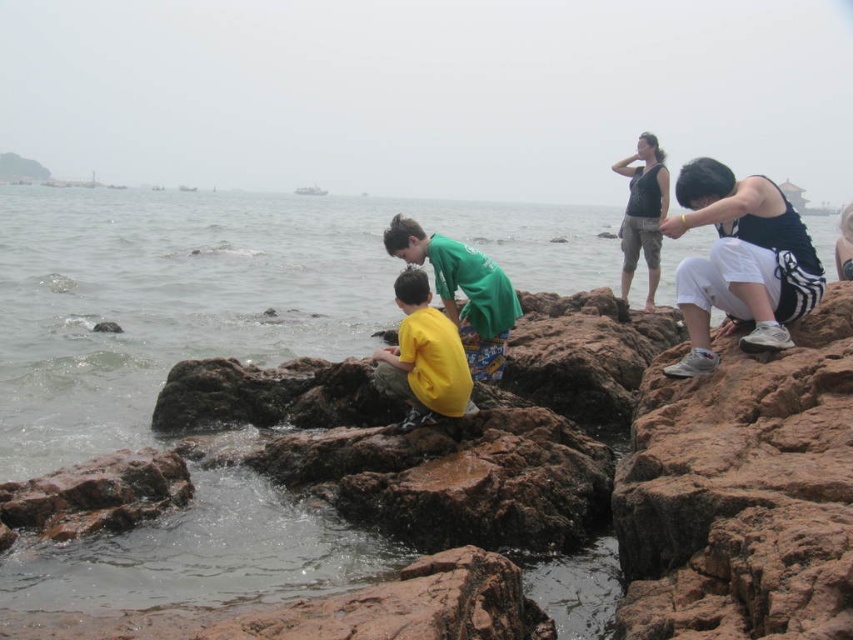
Question: Considering the real-world distances, which object is farthest from the yellow matte shirt at center?

Choices:
 (A) white athletic pants at right
 (B) brown rough rocks at center
 (C) dark green fabric shirt at upper center
 (D) green fabric shirt at center

Answer: (C)

Question: Is green fabric shirt at center further to the viewer compared to dark green fabric shirt at upper center?

Choices:
 (A) yes
 (B) no

Answer: (B)

Question: Which point is closer to the camera?

Choices:
 (A) (485, 307)
 (B) (376, 616)
 (C) (399, 388)

Answer: (B)

Question: Does brown rough rocks at center appear under dark green fabric shirt at upper center?

Choices:
 (A) no
 (B) yes

Answer: (B)

Question: Which of the following is the farthest from the observer?

Choices:
 (A) green fabric shirt at center
 (B) brown rough rocks at center
 (C) dark green fabric shirt at upper center

Answer: (C)

Question: Does brown rough rocks at center come in front of green fabric shirt at center?

Choices:
 (A) yes
 (B) no

Answer: (A)